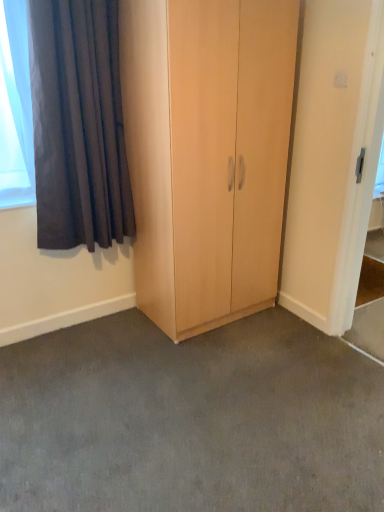
Question: Considering the positions of point (46, 434) and point (360, 151), is point (46, 434) closer or farther from the camera than point (360, 151)?

Choices:
 (A) closer
 (B) farther

Answer: (A)

Question: Is gray carpet at center situated inside white glossy screen door at upper right or outside?

Choices:
 (A) outside
 (B) inside

Answer: (A)

Question: Which object is the closest to the gray carpet at center?

Choices:
 (A) white glossy screen door at upper right
 (B) light wood cupboard at center
 (C) dark grey velvet curtain at upper left

Answer: (B)

Question: Which object is the closest to the gray carpet at center?

Choices:
 (A) light wood cupboard at center
 (B) white glossy screen door at upper right
 (C) dark grey velvet curtain at upper left

Answer: (A)